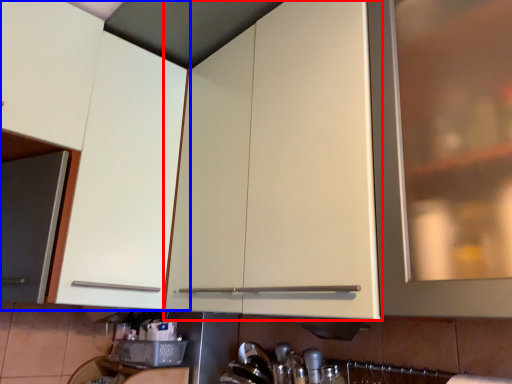
Question: Which object is further to the camera taking this photo, cabinetry (highlighted by a red box) or cabinetry (highlighted by a blue box)?

Choices:
 (A) cabinetry
 (B) cabinetry

Answer: (B)